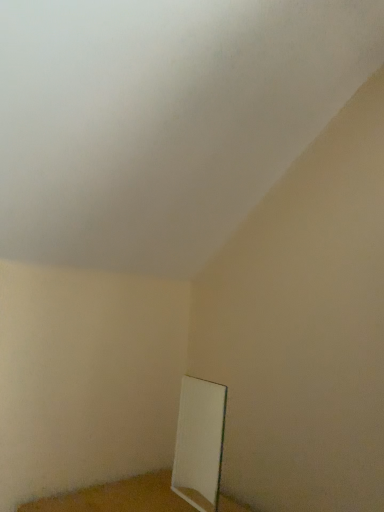
Question: Should I look upward or downward to see white glossy mirror at lower center?

Choices:
 (A) down
 (B) up

Answer: (A)